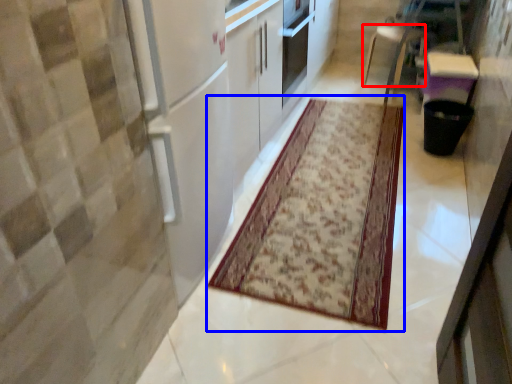
Question: Which object appears farthest to the camera in this image, furniture (highlighted by a red box) or mat (highlighted by a blue box)?

Choices:
 (A) furniture
 (B) mat

Answer: (A)